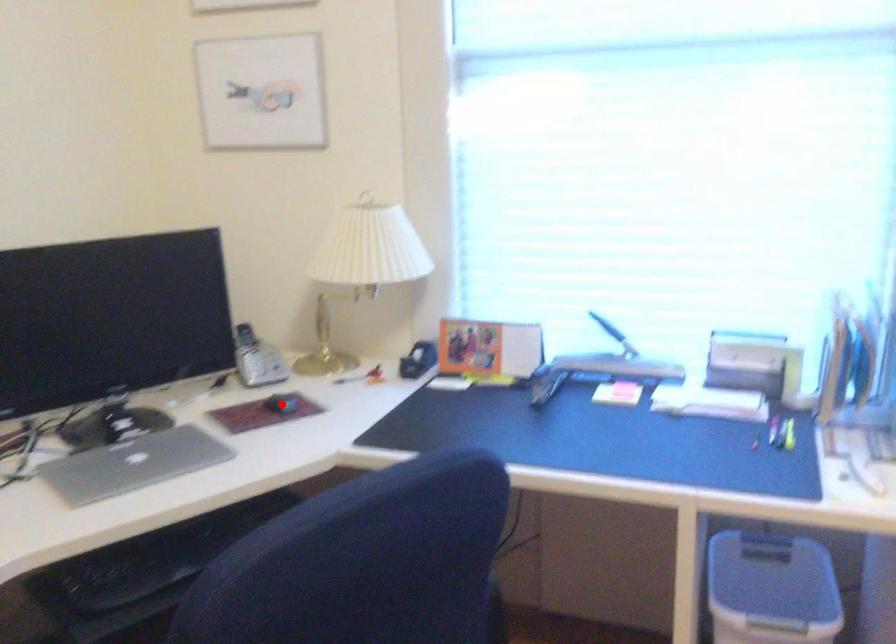
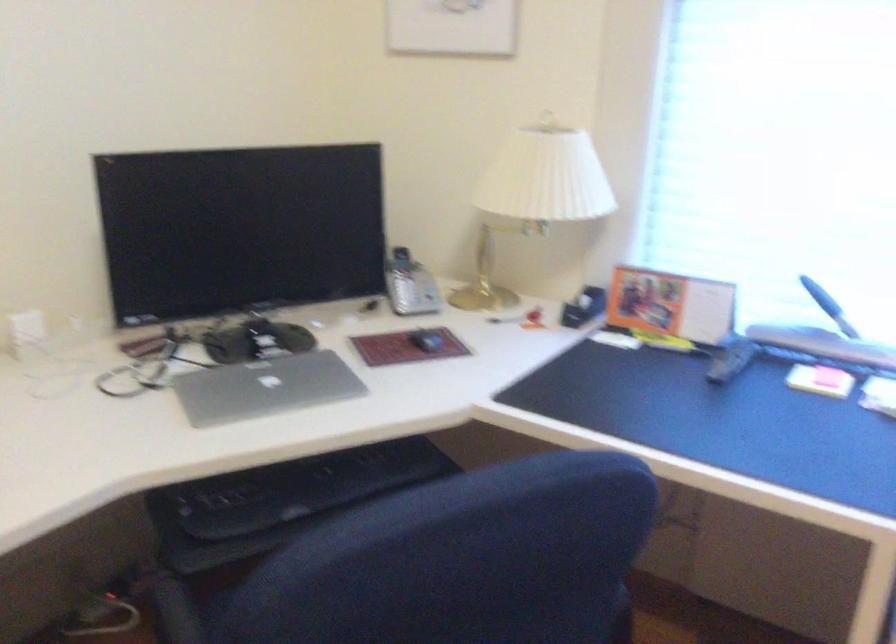
Find the pixel in the second image that matches the highlighted location in the first image.

(426, 341)